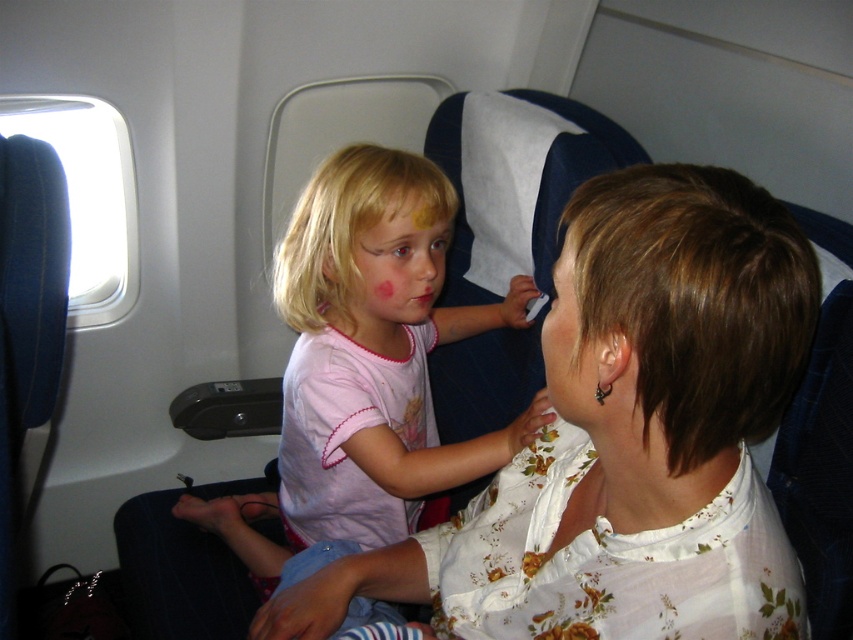
You are a flight attendant checking the seating arrangement. You see the white floral blouse at center and the light pink fabric face at center. Which one is positioned to the right?

The white floral blouse at center is to the right of the light pink fabric face at center.

You are a flight attendant checking seat dimensions. The airline requires that the width of the seat back must be at least 20 cm wider than the passenger ear width to ensure comfort. Given the white floral blouse at center and the matte white ear at center, can you determine if the seat back meets the airline requirement?

The white floral blouse at center is wider than the matte white ear at center. Since the airline requires the seat back to be at least 20 cm wider than the passenger ear width, and the white floral blouse at center surpasses the matte white ear at center in width, the seat back likely meets the requirement.